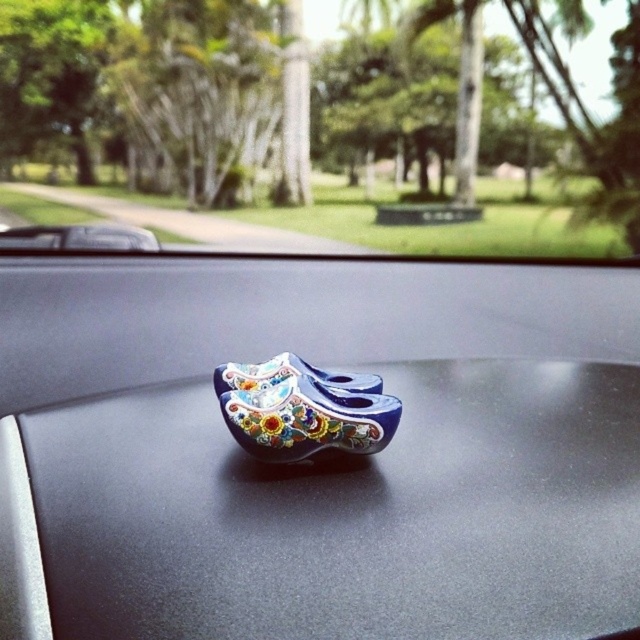
Which of these two, glossy ceramic clogs at center or transparent glass car window at center, stands taller?

transparent glass car window at center is taller.

Is glossy ceramic clogs at center below transparent glass car window at center?

Correct, glossy ceramic clogs at center is located below transparent glass car window at center.

Measure the distance between glossy ceramic clogs at center and camera.

37.95 inches

Locate an element on the screen. The height and width of the screenshot is (640, 640). glossy ceramic clogs at center is located at coordinates (349, 513).

Which is more to the left, transparent glass car window at center or blue glossy wooden shoes at center?

From the viewer's perspective, blue glossy wooden shoes at center appears more on the left side.

Can you confirm if transparent glass car window at center is positioned above blue glossy wooden shoes at center?

Yes, transparent glass car window at center is above blue glossy wooden shoes at center.

In the scene shown: Who is more distant from viewer, (477,172) or (332,387)?

The point (477,172) is more distant.

Find the location of a particular element. This screenshot has width=640, height=640. transparent glass car window at center is located at coordinates (324, 124).

Is glossy ceramic clogs at center to the right of blue glossy wooden shoes at center from the viewer's perspective?

Yes, glossy ceramic clogs at center is to the right of blue glossy wooden shoes at center.

Who is positioned more to the left, glossy ceramic clogs at center or blue glossy wooden shoes at center?

From the viewer's perspective, blue glossy wooden shoes at center appears more on the left side.

Who is more forward, (152, 582) or (312, 394)?

Point (152, 582) is in front.

At what (x,y) coordinates should I click in order to perform the action: click on glossy ceramic clogs at center. Please return your answer as a coordinate pair (x, y). The height and width of the screenshot is (640, 640). Looking at the image, I should click on (349, 513).